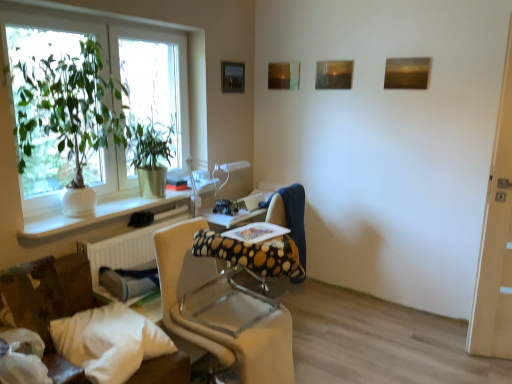
Question: From the image's perspective, is green glossy plant at left, positioned as the 1th houseplant in back-to-front order, located beneath white textured radiator at lower left?

Choices:
 (A) no
 (B) yes

Answer: (A)

Question: From the image's perspective, is green glossy plant at left, the 2th houseplant from the front, above white textured radiator at lower left?

Choices:
 (A) no
 (B) yes

Answer: (B)

Question: Considering the relative sizes of green glossy plant at left, positioned as the 1th houseplant in back-to-front order, and white textured radiator at lower left in the image provided, is green glossy plant at left, positioned as the 1th houseplant in back-to-front order, thinner than white textured radiator at lower left?

Choices:
 (A) yes
 (B) no

Answer: (B)

Question: Is green glossy plant at left, positioned as the 1th houseplant in back-to-front order, far away from white textured radiator at lower left?

Choices:
 (A) yes
 (B) no

Answer: (B)

Question: Can you confirm if green glossy plant at left, the 2th houseplant from the front, is taller than white textured radiator at lower left?

Choices:
 (A) yes
 (B) no

Answer: (A)

Question: From a real-world perspective, is green glossy plant at left, positioned as the 1th houseplant in back-to-front order, positioned over white textured radiator at lower left based on gravity?

Choices:
 (A) yes
 (B) no

Answer: (A)

Question: Considering the relative sizes of matte wooden picture frame at upper center, the third picture frame viewed from the right, and wooden textured painting at upper right, placed as the 4th picture frame when sorted from left to right, in the image provided, is matte wooden picture frame at upper center, the third picture frame viewed from the right, shorter than wooden textured painting at upper right, placed as the 4th picture frame when sorted from left to right,?

Choices:
 (A) yes
 (B) no

Answer: (B)

Question: From the image's perspective, is matte wooden picture frame at upper center, the third picture frame viewed from the right, over wooden textured painting at upper right, which is the 1th picture frame in right-to-left order?

Choices:
 (A) no
 (B) yes

Answer: (B)

Question: Is matte wooden picture frame at upper center, the third picture frame viewed from the right, wider than wooden textured painting at upper right, which is the 1th picture frame in right-to-left order?

Choices:
 (A) no
 (B) yes

Answer: (A)

Question: From the image's perspective, is matte wooden picture frame at upper center, the third picture frame viewed from the right, beneath wooden textured painting at upper right, placed as the 4th picture frame when sorted from left to right?

Choices:
 (A) no
 (B) yes

Answer: (A)

Question: Considering the relative sizes of matte wooden picture frame at upper center, the third picture frame viewed from the right, and wooden textured painting at upper right, which is the 1th picture frame in right-to-left order, in the image provided, is matte wooden picture frame at upper center, the third picture frame viewed from the right, smaller than wooden textured painting at upper right, which is the 1th picture frame in right-to-left order,?

Choices:
 (A) yes
 (B) no

Answer: (A)

Question: From a real-world perspective, is matte wooden picture frame at upper center, which is the 2th picture frame in left-to-right order, located higher than wooden textured painting at upper right, which is the 1th picture frame in right-to-left order?

Choices:
 (A) no
 (B) yes

Answer: (A)

Question: Is beige fabric chair at center next to green glossy plant at left, positioned as the 1th houseplant in back-to-front order, and touching it?

Choices:
 (A) yes
 (B) no

Answer: (B)